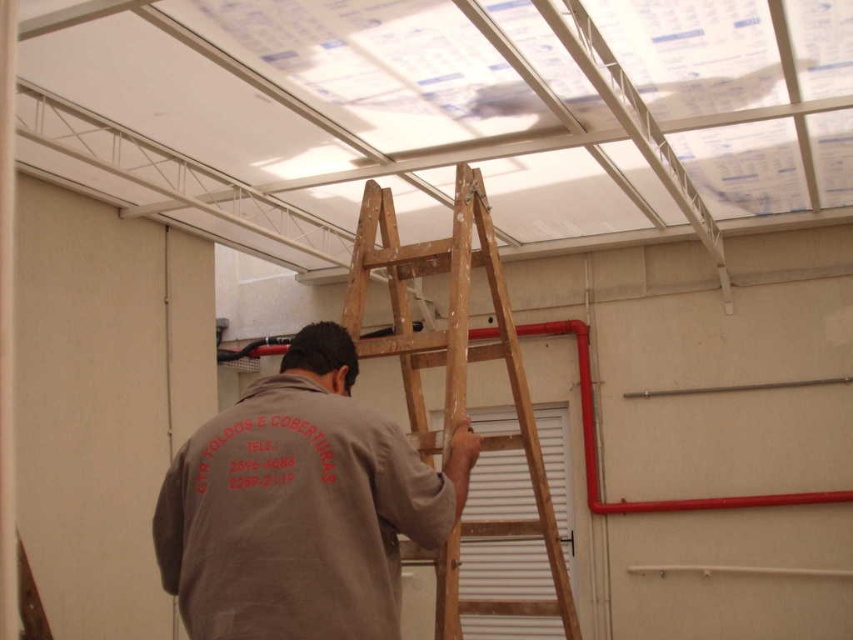
You are an inspector checking the construction site. You notice the brown cotton shirt at center and the wooden at upper center. Which object is closer to the ceiling?

The wooden at upper center is closer to the ceiling because it is taller than the brown cotton shirt at center.

You are a safety inspector in the construction site. You notice the brown cotton shirt at center and the wooden at upper center. Which object is closer to you as you look at the scene?

The brown cotton shirt at center is closer to you because it is in front of the wooden at upper center.

You are a safety inspector standing 1.5 meters away from the ladder. You see the brown cotton shirt at center hanging from the ladder. Is the shirt within your reach if you extend your arm fully, which has a maximum reach of 2 meters?

The brown cotton shirt at center is 1.75 meters away from the viewer. Since the inspector is 1.5 meters away from the ladder and can reach up to 2 meters, the total distance from the inspector to the shirt would be 1.5 meters plus the distance from the ladder to the shirt. However, the description only specifies the shirt is 1.75 meters from the viewer, so if the inspector is already 1.5 meters from the ladder, the shirt might be within reach if the remaining distance from the ladder to the shirt is within